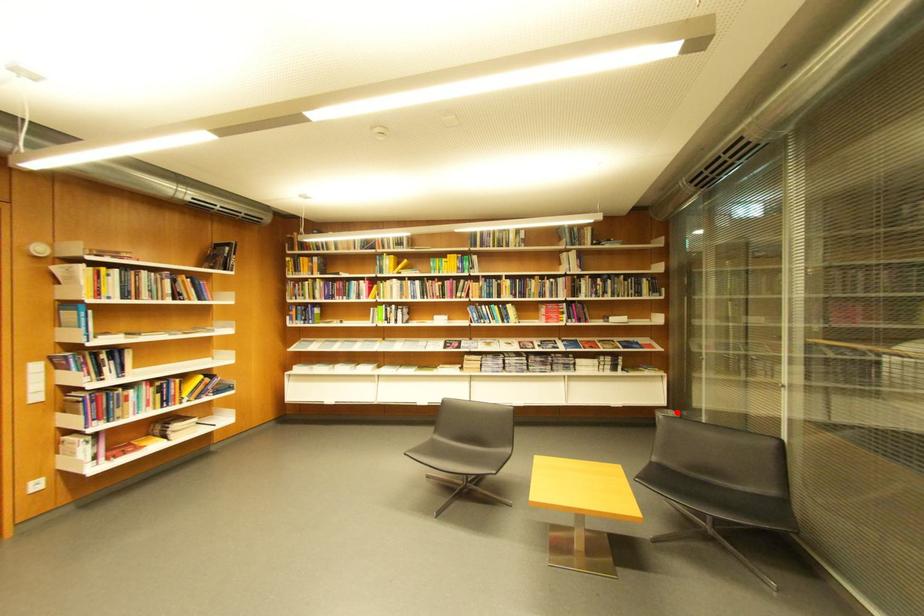
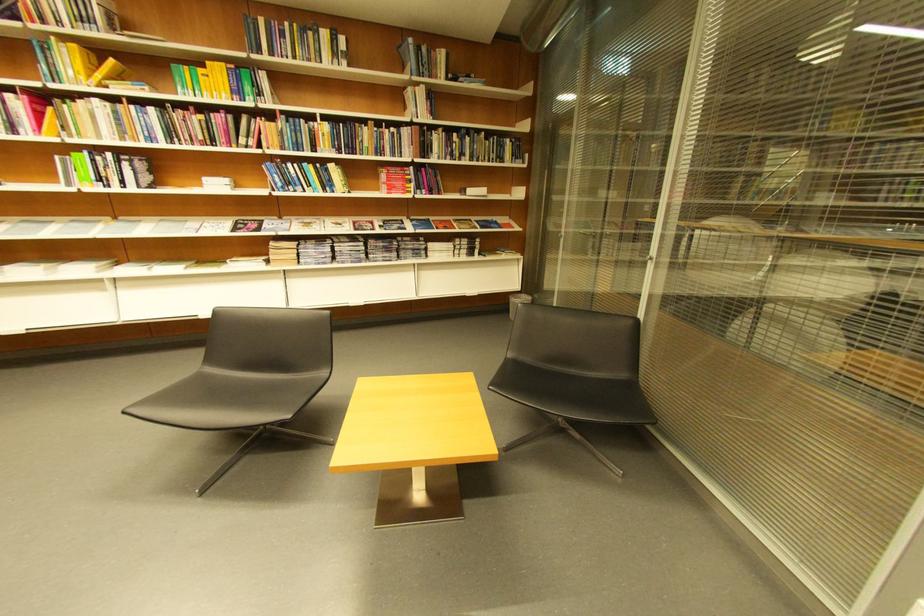
Find the pixel in the second image that matches the highlighted location in the first image.

(529, 297)